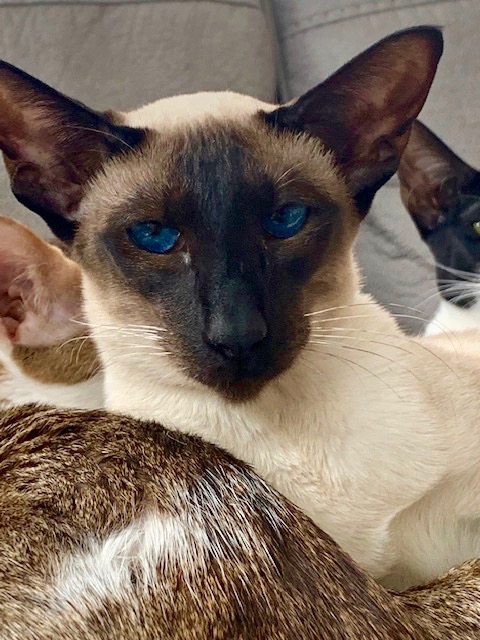
Find the location of a particular element. white fur is located at coordinates (118, 576).